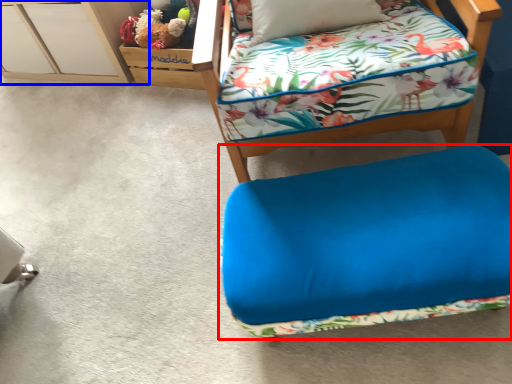
Question: Which point is closer to the camera, furniture (highlighted by a red box) or file cabinet (highlighted by a blue box)?

Choices:
 (A) furniture
 (B) file cabinet

Answer: (A)